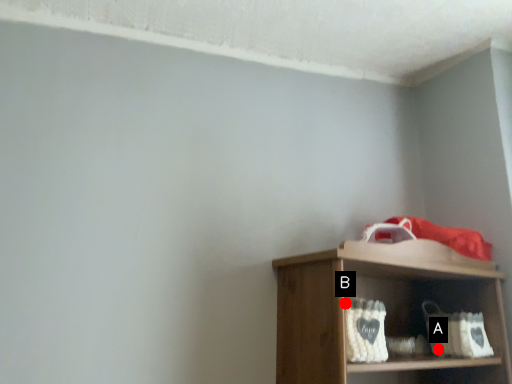
Question: Two points are circled on the image, labeled by A and B beside each circle. Which of the following is the farthest from the observer?

Choices:
 (A) A is further
 (B) B is further

Answer: (A)